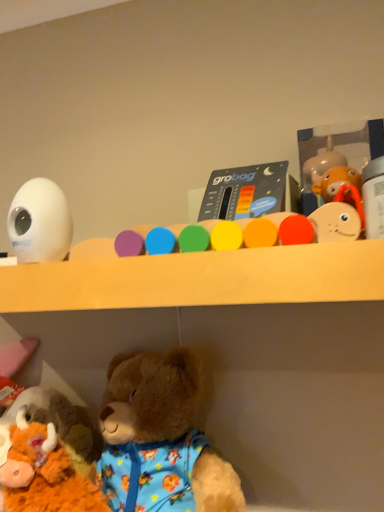
Describe the element at coordinates (40, 222) in the screenshot. I see `white glossy egg at upper left, the third toy viewed from the top` at that location.

Where is `matte plastic thermometer at center, placed as the 2th toy when sorted from right to left`? This screenshot has height=512, width=384. matte plastic thermometer at center, placed as the 2th toy when sorted from right to left is located at coordinates (245, 192).

Measure the distance between point (272, 195) and camera.

Point (272, 195) is 55.50 centimeters from camera.

What are the coordinates of `white glossy egg at upper left, the third toy viewed from the top` in the screenshot? It's located at (40, 222).

Between point (367, 180) and point (258, 195), which one is positioned behind?

Point (258, 195)

Measure the distance between white plastic bottle at upper right, which appears as the first toy when viewed from the right, and matte plastic thermometer at center, placed as the 2th toy when sorted from right to left.

white plastic bottle at upper right, which appears as the first toy when viewed from the right, is 15.31 centimeters away from matte plastic thermometer at center, placed as the 2th toy when sorted from right to left.

From a real-world perspective, relative to matte plastic thermometer at center, placed as the 2th toy when sorted from right to left, is white plastic bottle at upper right, which appears as the second toy when viewed from the top, vertically above or below?

white plastic bottle at upper right, which appears as the second toy when viewed from the top, is situated lower than matte plastic thermometer at center, placed as the 2th toy when sorted from right to left, in the real world.

From the picture: Which is more to the right, white glossy egg at upper left, marked as the 3th toy in a right-to-left arrangement, or white plastic bottle at upper right, which is counted as the 3th toy, starting from the bottom?

From the viewer's perspective, white plastic bottle at upper right, which is counted as the 3th toy, starting from the bottom, appears more on the right side.

From the picture: From a real-world perspective, does white glossy egg at upper left, the second toy positioned from the left, stand above white plastic bottle at upper right, which is counted as the 3th toy, starting from the bottom?

Indeed, from a real-world perspective, white glossy egg at upper left, the second toy positioned from the left, stands above white plastic bottle at upper right, which is counted as the 3th toy, starting from the bottom.

Between white glossy egg at upper left, arranged as the 2th toy when ordered from the bottom, and white plastic bottle at upper right, which appears as the first toy when viewed from the right, which one is positioned in front?

white plastic bottle at upper right, which appears as the first toy when viewed from the right, is more forward.

Would you say white glossy egg at upper left, the second toy positioned from the left, is a long distance from white plastic bottle at upper right, which is counted as the 3th toy, starting from the bottom?

No.

Would you say matte plastic thermometer at center, placed as the 2th toy when sorted from right to left, is inside or outside white plastic bottle at upper right, which appears as the second toy when viewed from the top?

matte plastic thermometer at center, placed as the 2th toy when sorted from right to left, is outside white plastic bottle at upper right, which appears as the second toy when viewed from the top.

Between matte plastic thermometer at center, placed as the 4th toy when sorted from bottom to top, and white plastic bottle at upper right, positioned as the fourth toy in left-to-right order, which one has smaller size?

Smaller between the two is white plastic bottle at upper right, positioned as the fourth toy in left-to-right order.

Is matte plastic thermometer at center, which appears as the 1th toy when viewed from the top, not near white plastic bottle at upper right, which appears as the second toy when viewed from the top?

Actually, matte plastic thermometer at center, which appears as the 1th toy when viewed from the top, and white plastic bottle at upper right, which appears as the second toy when viewed from the top, are a little close together.

Is fluffy brown teddy bear at lower left far from fluffy brown teddy bear at lower left, which is counted as the first toy, starting from the bottom?

No, fluffy brown teddy bear at lower left is not far from fluffy brown teddy bear at lower left, which is counted as the first toy, starting from the bottom.

In terms of width, does fluffy brown teddy bear at lower left look wider or thinner when compared to fluffy brown teddy bear at lower left, placed as the fourth toy when sorted from top to bottom?

In the image, fluffy brown teddy bear at lower left appears to be more narrow than fluffy brown teddy bear at lower left, placed as the fourth toy when sorted from top to bottom.

Who is more distant, fluffy brown teddy bear at lower left or fluffy brown teddy bear at lower left, which is the 1th toy from left to right?

fluffy brown teddy bear at lower left, which is the 1th toy from left to right, is more distant.

Is fluffy brown teddy bear at lower left oriented towards fluffy brown teddy bear at lower left, placed as the fourth toy when sorted from top to bottom?

No, fluffy brown teddy bear at lower left is not facing towards fluffy brown teddy bear at lower left, placed as the fourth toy when sorted from top to bottom.

Are white glossy egg at upper left, the third toy viewed from the top, and matte plastic thermometer at center, placed as the 2th toy when sorted from right to left, far apart?

They are positioned close to each other.

In terms of width, does white glossy egg at upper left, arranged as the 2th toy when ordered from the bottom, look wider or thinner when compared to matte plastic thermometer at center, arranged as the 3th toy when viewed from the left?

Clearly, white glossy egg at upper left, arranged as the 2th toy when ordered from the bottom, has more width compared to matte plastic thermometer at center, arranged as the 3th toy when viewed from the left.

Considering the positions of objects white glossy egg at upper left, the second toy positioned from the left, and matte plastic thermometer at center, placed as the 2th toy when sorted from right to left, in the image provided, who is behind, white glossy egg at upper left, the second toy positioned from the left, or matte plastic thermometer at center, placed as the 2th toy when sorted from right to left,?

matte plastic thermometer at center, placed as the 2th toy when sorted from right to left, is behind.

Could you tell me if white glossy egg at upper left, the second toy positioned from the left, is turned towards matte plastic thermometer at center, arranged as the 3th toy when viewed from the left?

No.

Which toy is the 3rd one when counting from the left side of the white plastic bottle at upper right, which appears as the second toy when viewed from the top? Please provide its 2D coordinates.

[(44, 473)]

How many degrees apart are the facing directions of white plastic bottle at upper right, which is counted as the 3th toy, starting from the bottom, and fluffy brown teddy bear at lower left, placed as the fourth toy when sorted from top to bottom?

white plastic bottle at upper right, which is counted as the 3th toy, starting from the bottom, and fluffy brown teddy bear at lower left, placed as the fourth toy when sorted from top to bottom, are facing 0.826 degrees away from each other.

From the image's perspective, is white plastic bottle at upper right, positioned as the fourth toy in left-to-right order, located above or below fluffy brown teddy bear at lower left, the fourth toy when ordered from right to left?

From the image's perspective, white plastic bottle at upper right, positioned as the fourth toy in left-to-right order, appears above fluffy brown teddy bear at lower left, the fourth toy when ordered from right to left.

Is white plastic bottle at upper right, which appears as the first toy when viewed from the right, not near fluffy brown teddy bear at lower left, which is the 1th toy from left to right?

No, there isn't a large distance between white plastic bottle at upper right, which appears as the first toy when viewed from the right, and fluffy brown teddy bear at lower left, which is the 1th toy from left to right.

Is white plastic bottle at upper right, which appears as the first toy when viewed from the right, located within fluffy brown teddy bear at lower left?

No, white plastic bottle at upper right, which appears as the first toy when viewed from the right, is not inside fluffy brown teddy bear at lower left.

Considering the positions of objects fluffy brown teddy bear at lower left and white plastic bottle at upper right, positioned as the fourth toy in left-to-right order, in the image provided, who is more to the right, fluffy brown teddy bear at lower left or white plastic bottle at upper right, positioned as the fourth toy in left-to-right order,?

white plastic bottle at upper right, positioned as the fourth toy in left-to-right order.

From the image's perspective, between fluffy brown teddy bear at lower left and white plastic bottle at upper right, positioned as the fourth toy in left-to-right order, who is located below?

fluffy brown teddy bear at lower left, from the image's perspective.

From a real-world perspective, which object stands above the other?

white plastic bottle at upper right, which appears as the second toy when viewed from the top, is physically above.

Identify the location of the 3rd toy behind the white plastic bottle at upper right, which appears as the first toy when viewed from the right, counting from the anchor's position. (245, 192).

Find the location of a particular element. the 2nd toy to the left of the white plastic bottle at upper right, positioned as the fourth toy in left-to-right order, counting from the anchor's position is located at coordinates (40, 222).

When comparing their distances from white plastic bottle at upper right, positioned as the fourth toy in left-to-right order, does matte plastic thermometer at center, placed as the 4th toy when sorted from bottom to top, or fluffy brown teddy bear at lower left seem closer?

Based on the image, matte plastic thermometer at center, placed as the 4th toy when sorted from bottom to top, appears to be nearer to white plastic bottle at upper right, positioned as the fourth toy in left-to-right order.

From the image, which object appears to be farther from white plastic bottle at upper right, which appears as the second toy when viewed from the top, fluffy brown teddy bear at lower left or matte plastic thermometer at center, arranged as the 3th toy when viewed from the left?

fluffy brown teddy bear at lower left lies further to white plastic bottle at upper right, which appears as the second toy when viewed from the top, than the other object.

Looking at the image, which one is located further to white plastic bottle at upper right, which is counted as the 3th toy, starting from the bottom, matte plastic thermometer at center, placed as the 2th toy when sorted from right to left, or white glossy egg at upper left, arranged as the 2th toy when ordered from the bottom?

white glossy egg at upper left, arranged as the 2th toy when ordered from the bottom, lies further to white plastic bottle at upper right, which is counted as the 3th toy, starting from the bottom, than the other object.

Based on their spatial positions, is fluffy brown teddy bear at lower left, which is the 1th toy from left to right, or white glossy egg at upper left, arranged as the 2th toy when ordered from the bottom, further from white plastic bottle at upper right, which is counted as the 3th toy, starting from the bottom?

fluffy brown teddy bear at lower left, which is the 1th toy from left to right, is further to white plastic bottle at upper right, which is counted as the 3th toy, starting from the bottom.

From the picture: Based on their spatial positions, is fluffy brown teddy bear at lower left, the fourth toy when ordered from right to left, or white glossy egg at upper left, the second toy positioned from the left, further from fluffy brown teddy bear at lower left?

white glossy egg at upper left, the second toy positioned from the left, is further to fluffy brown teddy bear at lower left.

Looking at this image, looking at the image, which one is located further to fluffy brown teddy bear at lower left, matte plastic thermometer at center, arranged as the 3th toy when viewed from the left, or fluffy brown teddy bear at lower left, which is the 1th toy from left to right?

Based on the image, matte plastic thermometer at center, arranged as the 3th toy when viewed from the left, appears to be further to fluffy brown teddy bear at lower left.

Estimate the real-world distances between objects in this image. Which object is closer to matte plastic thermometer at center, which appears as the 1th toy when viewed from the top, fluffy brown teddy bear at lower left or white plastic bottle at upper right, which appears as the second toy when viewed from the top?

Among the two, white plastic bottle at upper right, which appears as the second toy when viewed from the top, is located nearer to matte plastic thermometer at center, which appears as the 1th toy when viewed from the top.

Based on their spatial positions, is fluffy brown teddy bear at lower left or matte plastic thermometer at center, placed as the 2th toy when sorted from right to left, further from fluffy brown teddy bear at lower left, placed as the fourth toy when sorted from top to bottom?

The object further to fluffy brown teddy bear at lower left, placed as the fourth toy when sorted from top to bottom, is matte plastic thermometer at center, placed as the 2th toy when sorted from right to left.

At what (x,y) coordinates should I click in order to perform the action: click on teddy bear situated between white glossy egg at upper left, the third toy viewed from the top, and white plastic bottle at upper right, positioned as the fourth toy in left-to-right order, from left to right. Please return your answer as a coordinate pair (x, y). The width and height of the screenshot is (384, 512). Looking at the image, I should click on (160, 439).

The image size is (384, 512). I want to click on teddy bear between matte plastic thermometer at center, arranged as the 3th toy when viewed from the left, and fluffy brown teddy bear at lower left, placed as the fourth toy when sorted from top to bottom, vertically, so click(160, 439).

Locate an element on the screen. This screenshot has width=384, height=512. teddy bear between white glossy egg at upper left, arranged as the 2th toy when ordered from the bottom, and fluffy brown teddy bear at lower left, which is the 1th toy from left to right, vertically is located at coordinates (160, 439).

Identify the location of teddy bear situated between fluffy brown teddy bear at lower left, which is the 1th toy from left to right, and white plastic bottle at upper right, which is counted as the 3th toy, starting from the bottom, from left to right. (160, 439).